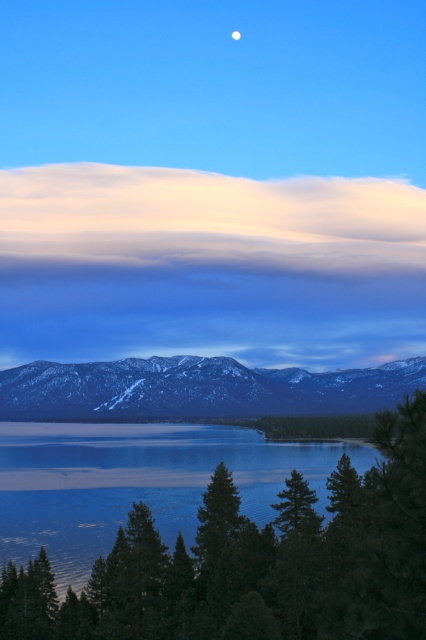
Based on the scene described, if you were standing at point (138,483), what would you see directly in front of you?

You would see blue glassy water at lower center directly in front of you at point (138,483).